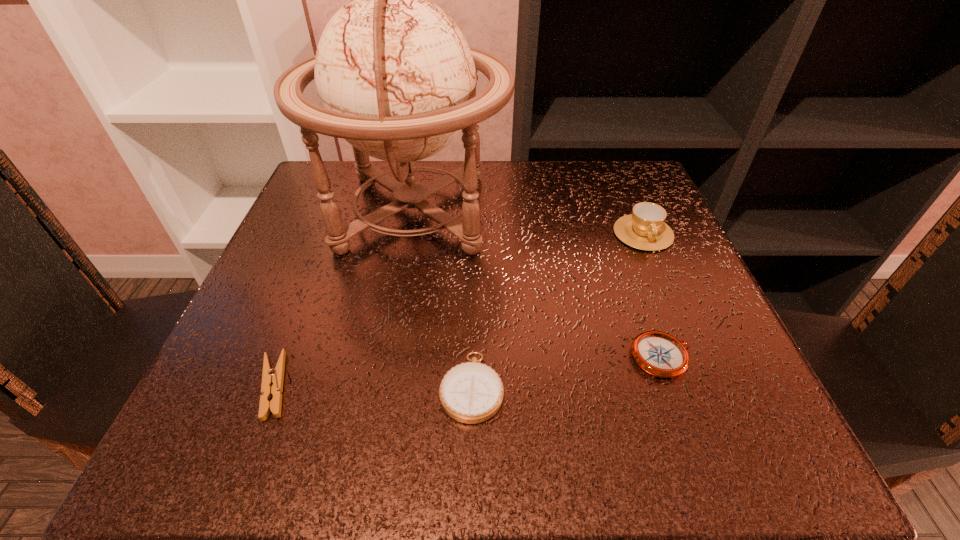
Find the location of a particular element. globe is located at coordinates (395, 76).

Where is `cup`? This screenshot has width=960, height=540. cup is located at coordinates (645, 229).

The height and width of the screenshot is (540, 960). I want to click on the left compass, so click(472, 392).

This screenshot has width=960, height=540. Find the location of `the right compass`. the right compass is located at coordinates (658, 353).

I want to click on clothespin, so click(272, 379).

Locate an element on the screen. Image resolution: width=960 pixels, height=540 pixels. free space located 0.270m at the front of the globe showing Africa is located at coordinates (636, 212).

The width and height of the screenshot is (960, 540). What are the coordinates of `vacant area located with the handle on the side of the cup` in the screenshot? It's located at (664, 282).

Find the location of a particular element. The width and height of the screenshot is (960, 540). free space located on the back of the left compass is located at coordinates (x=474, y=227).

Identify the location of vacant space located 0.160m on the left of the right compass. (524, 357).

At what (x,y) coordinates should I click in order to perform the action: click on vacant space located on the back of the shortest object. Please return your answer as a coordinate pair (x, y). Looking at the image, I should click on (322, 261).